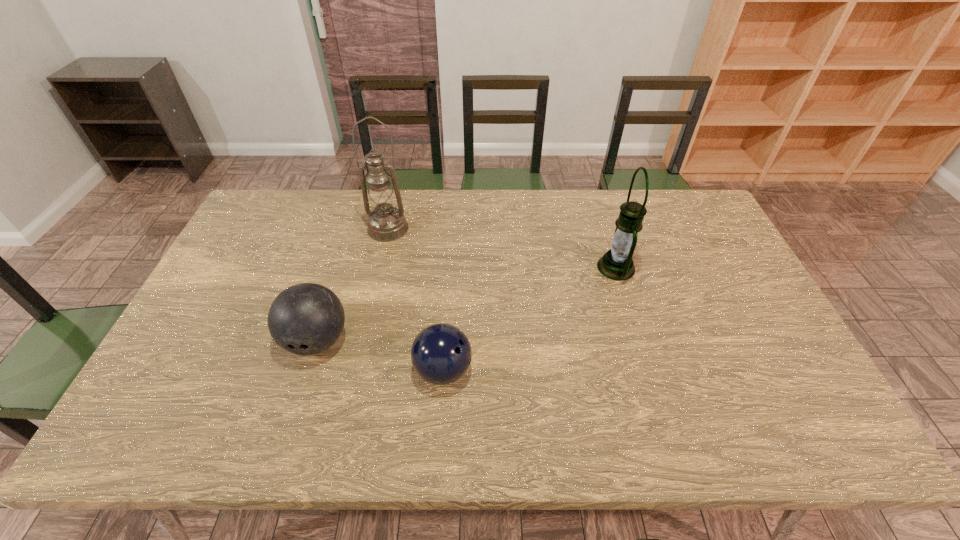
Find the location of a particular element. The image size is (960, 540). vacant area situated 0.070m on the side where the third nearest object emits light is located at coordinates (574, 267).

Identify the location of blank space located on the grip area of the second shortest object. This screenshot has width=960, height=540. (285, 440).

The height and width of the screenshot is (540, 960). What are the coordinates of `free location located 0.320m on the surface of the right bowling ball near the finger holes` in the screenshot? It's located at (600, 370).

This screenshot has width=960, height=540. I want to click on object that is at the far edge, so click(386, 223).

This screenshot has width=960, height=540. In the image, there is a desktop. Find the location of `vacant space at the far edge`. vacant space at the far edge is located at coordinates (542, 202).

Image resolution: width=960 pixels, height=540 pixels. I want to click on free space at the near edge, so click(530, 436).

Identify the location of vacant space at the left edge. The width and height of the screenshot is (960, 540). (238, 241).

Identify the location of vacant space at the right edge of the desktop. (766, 346).

Find the location of a particular element. vacant region at the far left corner of the desktop is located at coordinates (258, 224).

At what (x,y) coordinates should I click in order to perform the action: click on vacant space in between the second object from right to left and the second farthest object. Please return your answer as a coordinate pair (x, y). The height and width of the screenshot is (540, 960). Looking at the image, I should click on (530, 319).